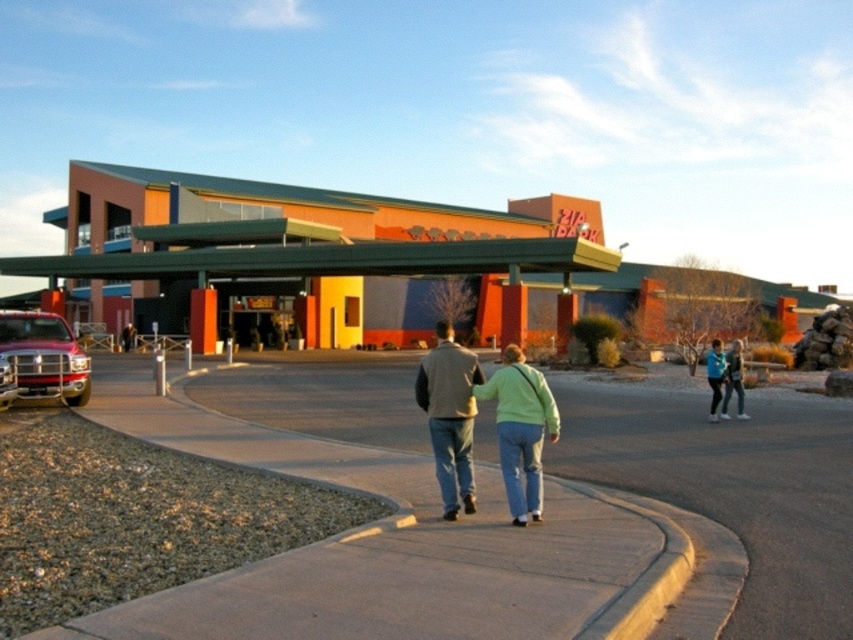
Does light green sweater at center appear on the right side of light blue sweater at center?

No, light green sweater at center is not to the right of light blue sweater at center.

The image size is (853, 640). Find the location of `light green sweater at center`. light green sweater at center is located at coordinates (520, 429).

Does point (601, 520) come behind point (25, 316)?

No, (601, 520) is closer to viewer.

Who is higher up, concrete at center or metallic red truck at left?

Positioned higher is metallic red truck at left.

Between point (567, 493) and point (84, 392), which one is positioned in front?

Point (567, 493) is more forward.

You are a GUI agent. You are given a task and a screenshot of the screen. Output one action in this format:
    pyautogui.click(x=<x>, y=<y>)
    Task: Click on the concrete at center
    This screenshot has height=640, width=853.
    Given the screenshot: What is the action you would take?
    pyautogui.click(x=376, y=545)

Who is taller, metallic red truck at left or light blue sweater at center?

With more height is metallic red truck at left.

Describe the element at coordinates (44, 356) in the screenshot. I see `metallic red truck at left` at that location.

I want to click on metallic red truck at left, so click(44, 356).